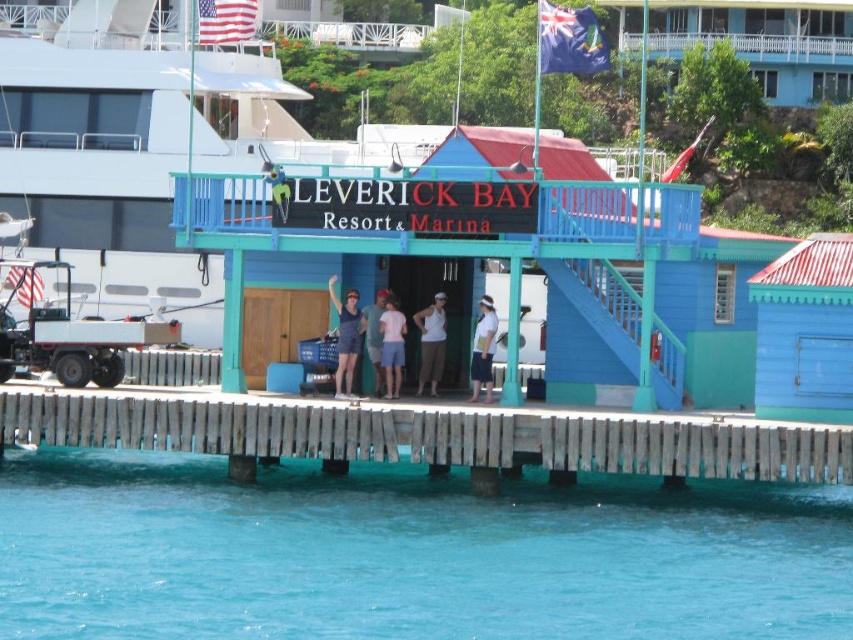
Can you confirm if white cotton tank top at center is bigger than pink fabric shorts at center?

Correct, white cotton tank top at center is larger in size than pink fabric shorts at center.

Is white cotton tank top at center to the left of pink fabric shorts at center from the viewer's perspective?

Incorrect, white cotton tank top at center is not on the left side of pink fabric shorts at center.

Where is `white cotton tank top at center`? white cotton tank top at center is located at coordinates pos(431,342).

Where is `white cotton tank top at center`? white cotton tank top at center is located at coordinates (431, 342).

Can you confirm if transparent blue water at lower center is bigger than blue wood hut at center?

Yes, transparent blue water at lower center is bigger than blue wood hut at center.

Measure the distance between point (686, 525) and camera.

Point (686, 525) and camera are 50.33 meters apart from each other.

At what (x,y) coordinates should I click in order to perform the action: click on transparent blue water at lower center. Please return your answer as a coordinate pair (x, y). Image resolution: width=853 pixels, height=640 pixels. Looking at the image, I should click on (409, 554).

Can you confirm if wooden planks at lower center is thinner than white fabric shirt at center?

No.

Consider the image. Who is shorter, wooden planks at lower center or white fabric shirt at center?

With less height is white fabric shirt at center.

Between point (280, 403) and point (479, 339), which one is positioned behind?

The point (479, 339) is more distant.

The image size is (853, 640). I want to click on wooden planks at lower center, so click(432, 435).